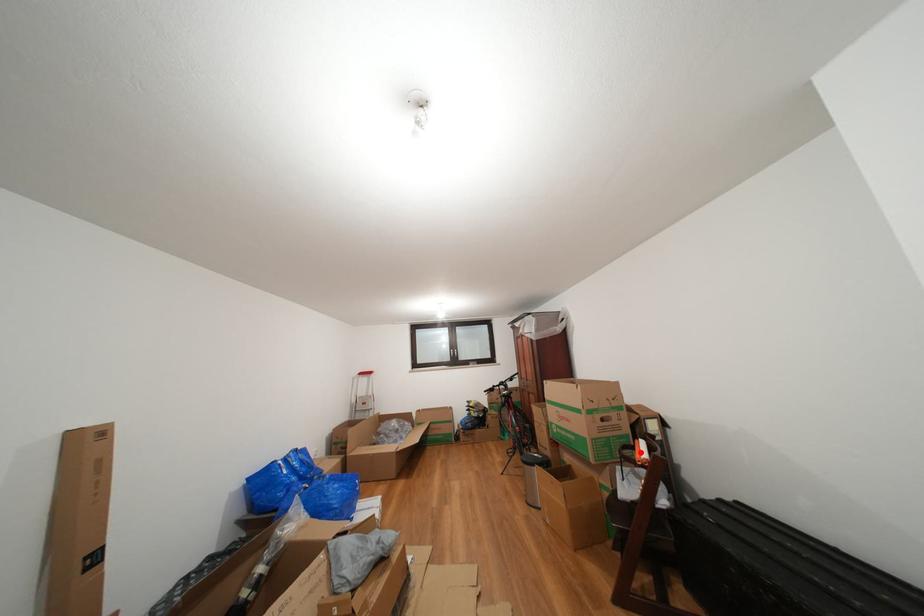
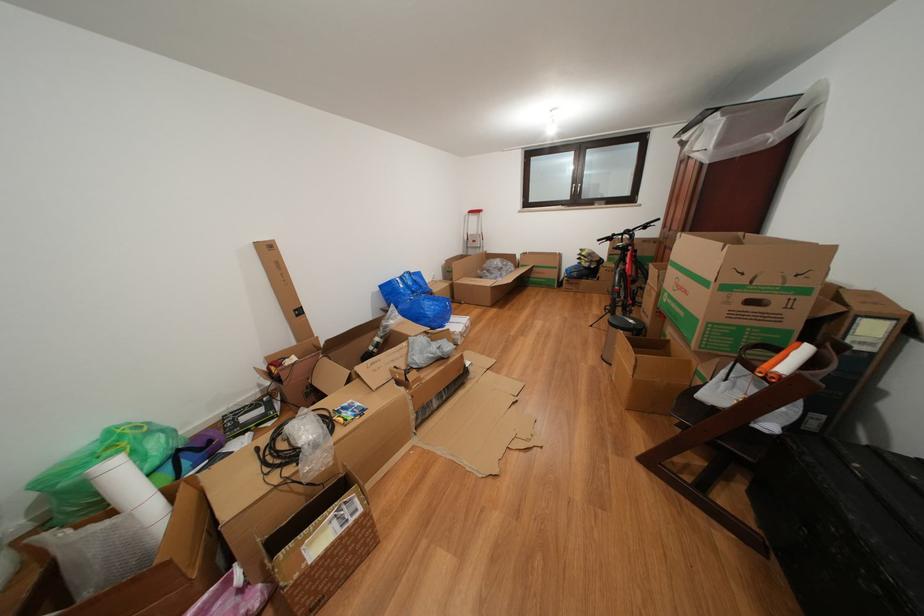
Question: I am providing you with two images of the same scene from different viewpoints. A red point is marked on the first image. Is the red point's position out of view in image 2?

Choices:
 (A) Yes
 (B) No

Answer: (B)